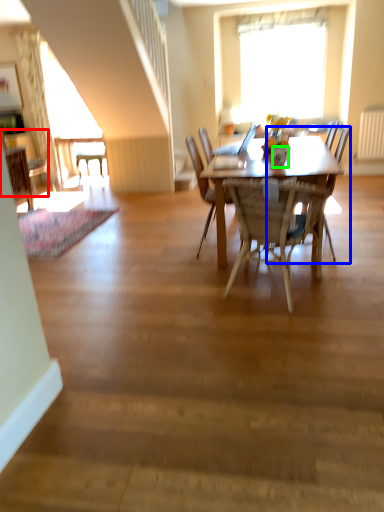
Question: Based on their relative distances, which object is farther from chair (highlighted by a red box)? Choose from chair (highlighted by a blue box) and vase (highlighted by a green box).

Choices:
 (A) chair
 (B) vase

Answer: (A)